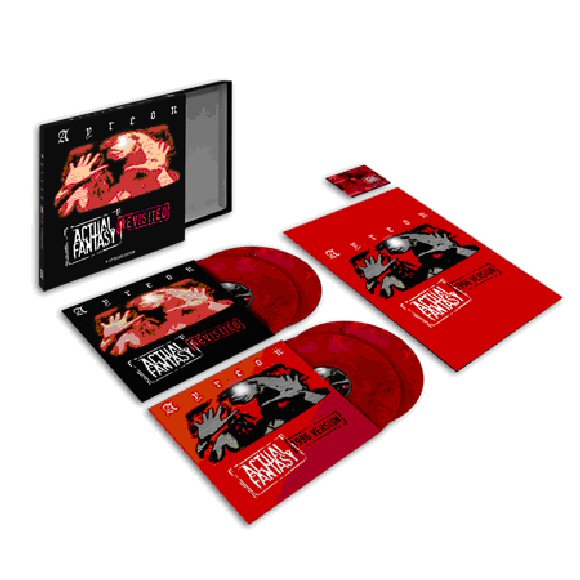
Locate an element on the screen. Image resolution: width=580 pixels, height=580 pixels. box is located at coordinates (142, 201).